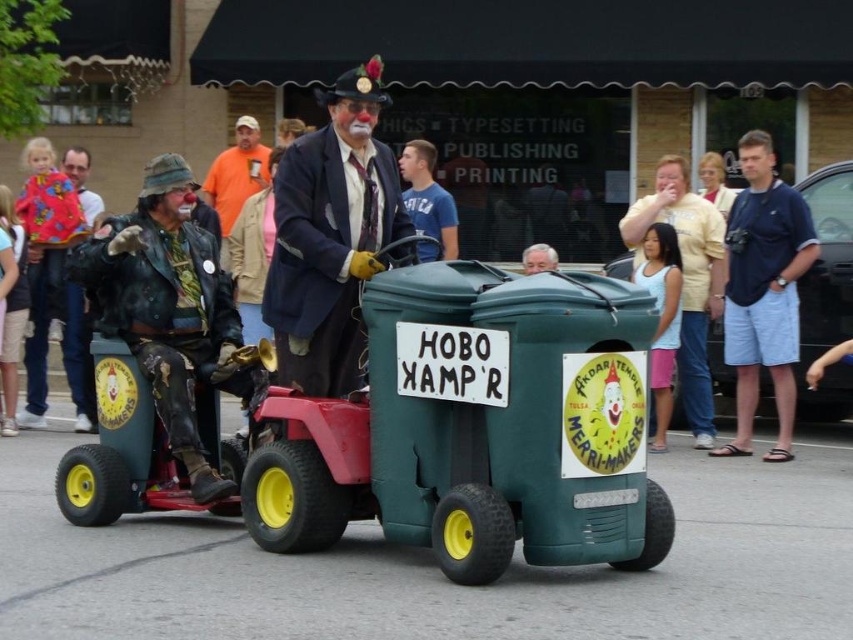
The image size is (853, 640). In order to click on matte black suit at center in this screenshot , I will do `click(331, 236)`.

The image size is (853, 640). I want to click on matte black suit at center, so click(x=331, y=236).

Is blue denim shorts at right smaller than smooth skin face at center?

No, blue denim shorts at right is not smaller than smooth skin face at center.

Is point (776, 237) less distant than point (538, 257)?

Yes, point (776, 237) is closer to viewer.

Where is `blue denim shorts at right`? The width and height of the screenshot is (853, 640). blue denim shorts at right is located at coordinates (764, 291).

Is matte black suit at center positioned in front of light yellow shirt at center?

Yes, matte black suit at center is closer to the viewer.

What do you see at coordinates (331, 236) in the screenshot?
I see `matte black suit at center` at bounding box center [331, 236].

Which is behind, point (334, 296) or point (712, 250)?

Positioned behind is point (712, 250).

You are a GUI agent. You are given a task and a screenshot of the screen. Output one action in this format:
    pyautogui.click(x=<x>, y=<y>)
    Task: Click on the matte black suit at center
    Image resolution: width=853 pixels, height=640 pixels.
    Given the screenshot: What is the action you would take?
    pyautogui.click(x=331, y=236)